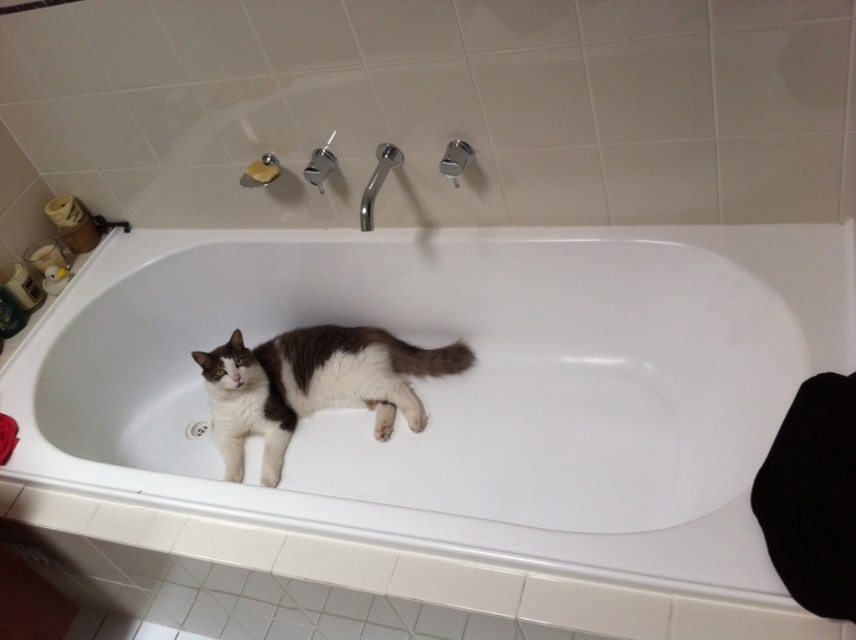
Does white glossy bathtub at center lie behind white fur cat at center?

No, it is in front of white fur cat at center.

Between white glossy bathtub at center and white fur cat at center, which one appears on the right side from the viewer's perspective?

white glossy bathtub at center is more to the right.

The height and width of the screenshot is (640, 856). Find the location of `white glossy bathtub at center`. white glossy bathtub at center is located at coordinates (450, 410).